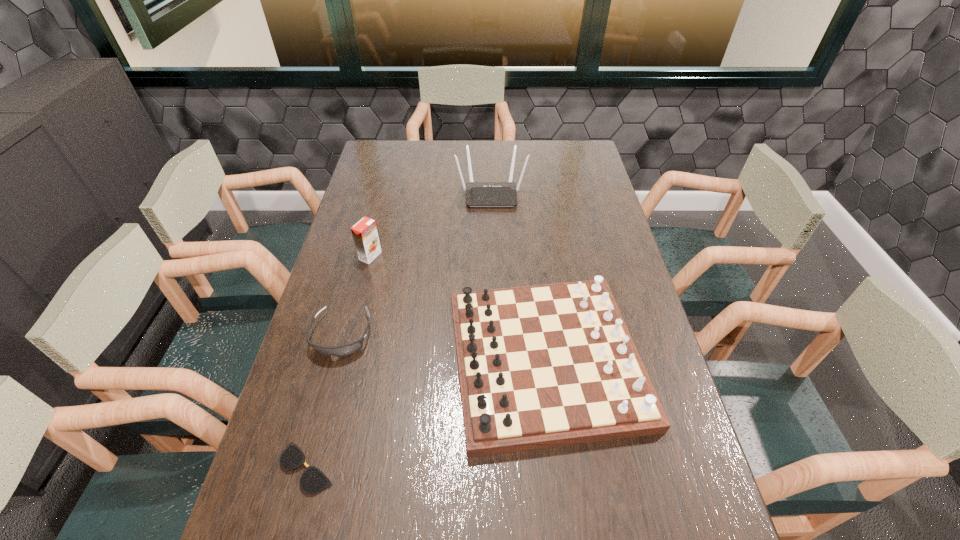
Find the location of a particular element. Image resolution: width=960 pixels, height=540 pixels. vacant area between the second shortest object and the fourth shortest object is located at coordinates (356, 295).

Where is `unoccupied position between the farthest object and the second tallest object`? unoccupied position between the farthest object and the second tallest object is located at coordinates (431, 225).

Locate an element on the screen. free area in between the orange juice and the fourth tallest object is located at coordinates (356, 295).

Where is `unoccupied position between the orange juice and the spectacles`? The width and height of the screenshot is (960, 540). unoccupied position between the orange juice and the spectacles is located at coordinates (339, 362).

Locate an element on the screen. The image size is (960, 540). empty location between the goggles and the spectacles is located at coordinates (324, 401).

Find the location of a particular element. The width and height of the screenshot is (960, 540). empty space that is in between the chessboard and the tallest object is located at coordinates (518, 276).

Where is `free area in between the router and the second tallest object`? free area in between the router and the second tallest object is located at coordinates (431, 225).

Find the location of a particular element. Image resolution: width=960 pixels, height=540 pixels. unoccupied position between the fourth tallest object and the second tallest object is located at coordinates (356, 295).

Select which object appears as the second closest to the spectacles. Please provide its 2D coordinates. Your answer should be formatted as a tuple, i.e. [(x, y)], where the tuple contains the x and y coordinates of a point satisfying the conditions above.

[(540, 366)]

This screenshot has height=540, width=960. Find the location of `object that is the third closest one to the chessboard`. object that is the third closest one to the chessboard is located at coordinates (364, 232).